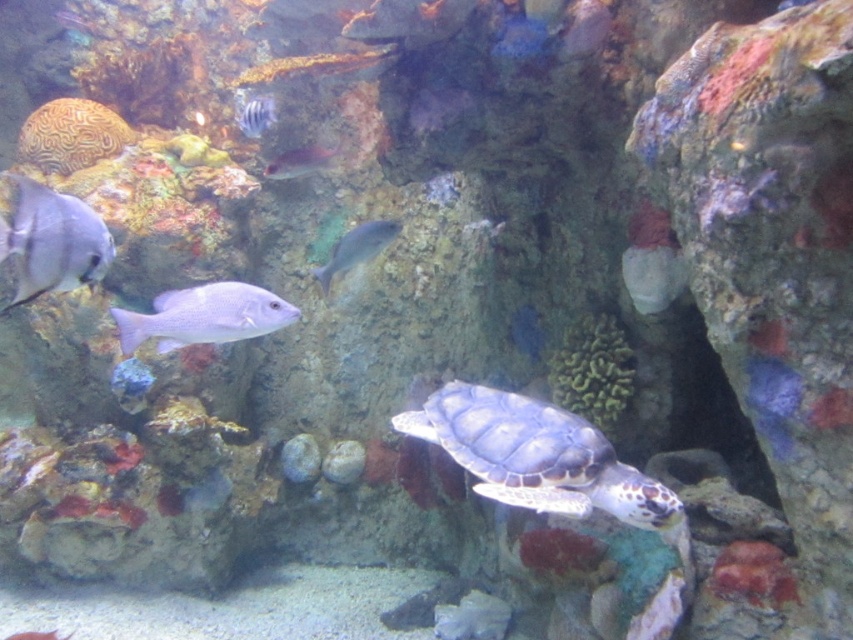
Is shiny silver fish at upper center in front of striped scales fish at upper left?

That is True.

Is shiny silver fish at upper center below striped scales fish at upper left?

Actually, shiny silver fish at upper center is above striped scales fish at upper left.

Is point (345, 61) positioned after point (267, 129)?

No, (345, 61) is in front of (267, 129).

The height and width of the screenshot is (640, 853). I want to click on shiny silver fish at upper center, so click(x=312, y=65).

Which of these two, purple matte fish at center or shiny silver fish at lower left, stands taller?

Standing taller between the two is purple matte fish at center.

Who is shorter, purple matte fish at center or shiny silver fish at lower left?

shiny silver fish at lower left

What are the coordinates of `purple matte fish at center` in the screenshot? It's located at (204, 316).

What are the coordinates of `purple matte fish at center` in the screenshot? It's located at click(204, 316).

Can you confirm if satin silver fish at center is shorter than translucent pinkish fish at upper center?

Incorrect, satin silver fish at center's height does not fall short of translucent pinkish fish at upper center's.

Is satin silver fish at center behind translucent pinkish fish at upper center?

No, satin silver fish at center is in front of translucent pinkish fish at upper center.

Between point (360, 256) and point (311, 160), which one is positioned in front?

Point (360, 256)

Identify the location of satin silver fish at center. (357, 248).